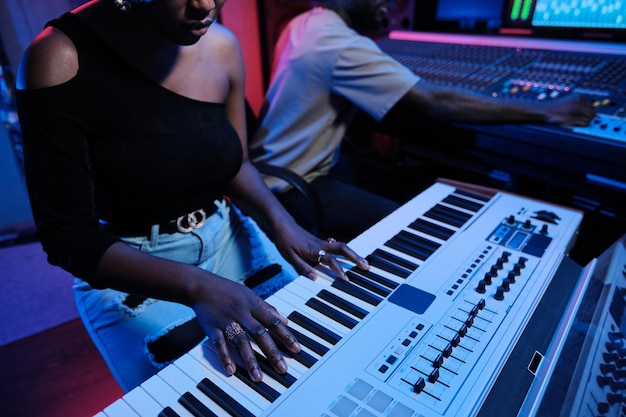
The width and height of the screenshot is (626, 417). What are the coordinates of `switches` in the screenshot? It's located at (483, 303), (476, 309), (470, 319), (466, 330), (453, 339), (446, 349), (434, 358), (431, 372), (414, 385).